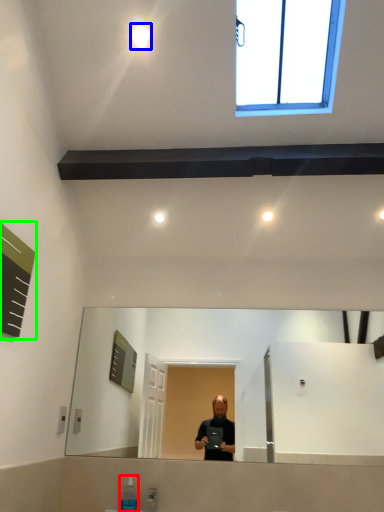
Question: Considering the real-world distances, which object is closest to toiletry (highlighted by a red box)? lighting (highlighted by a blue box) or bulletin board (highlighted by a green box).

Choices:
 (A) lighting
 (B) bulletin board

Answer: (B)